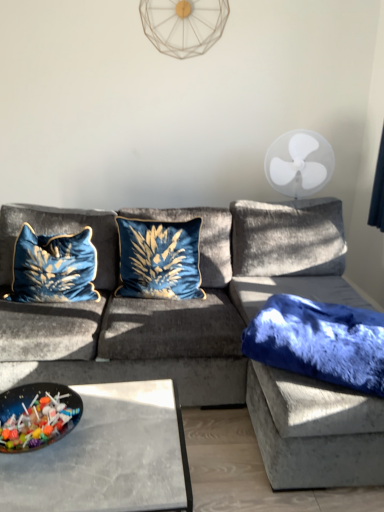
Question: Is white plastic fan at upper right, which is the second mechanical fan from left to right, next to velvet blue couch at center and touching it?

Choices:
 (A) yes
 (B) no

Answer: (B)

Question: Does white plastic fan at upper right, acting as the first mechanical fan starting from the bottom, have a smaller size compared to velvet blue couch at center?

Choices:
 (A) no
 (B) yes

Answer: (B)

Question: From a real-world perspective, is white plastic fan at upper right, acting as the first mechanical fan starting from the bottom, on velvet blue couch at center?

Choices:
 (A) yes
 (B) no

Answer: (A)

Question: From the image's perspective, does white plastic fan at upper right, the 2th mechanical fan from the top, appear higher than velvet blue couch at center?

Choices:
 (A) yes
 (B) no

Answer: (A)

Question: Considering the relative positions of white plastic fan at upper right, acting as the first mechanical fan starting from the bottom, and velvet blue couch at center in the image provided, is white plastic fan at upper right, acting as the first mechanical fan starting from the bottom, behind velvet blue couch at center?

Choices:
 (A) no
 (B) yes

Answer: (B)

Question: From the image's perspective, is velvet blue pillow at left, the third pillow viewed from the right, located above or below glossy plastic bowl of candy at lower left?

Choices:
 (A) below
 (B) above

Answer: (B)

Question: From a real-world perspective, relative to glossy plastic bowl of candy at lower left, is velvet blue pillow at left, the third pillow viewed from the right, vertically above or below?

Choices:
 (A) below
 (B) above

Answer: (B)

Question: In the image, is velvet blue pillow at left, the third pillow viewed from the right, positioned in front of or behind glossy plastic bowl of candy at lower left?

Choices:
 (A) behind
 (B) front

Answer: (A)

Question: Does point (69, 234) appear closer or farther from the camera than point (34, 414)?

Choices:
 (A) farther
 (B) closer

Answer: (A)

Question: From the image's perspective, is velvet blue pillow at left, the third pillow viewed from the right, positioned above or below velvet blue pillow at center, positioned as the second pillow in right-to-left order?

Choices:
 (A) below
 (B) above

Answer: (A)

Question: Is velvet blue pillow at left, which ranks as the first pillow in left-to-right order, spatially inside velvet blue pillow at center, positioned as the second pillow in right-to-left order, or outside of it?

Choices:
 (A) inside
 (B) outside

Answer: (B)

Question: In the image, is velvet blue pillow at left, which ranks as the first pillow in left-to-right order, positioned in front of or behind velvet blue pillow at center, the second pillow when ordered from left to right?

Choices:
 (A) behind
 (B) front

Answer: (B)

Question: Considering the relative positions of velvet blue pillow at left, which ranks as the first pillow in left-to-right order, and velvet blue pillow at center, the second pillow when ordered from left to right, in the image provided, is velvet blue pillow at left, which ranks as the first pillow in left-to-right order, to the left or to the right of velvet blue pillow at center, the second pillow when ordered from left to right,?

Choices:
 (A) left
 (B) right

Answer: (A)

Question: Considering their positions, is velvet blue couch at center located in front of or behind fuzzy blue blanket at right, marked as the 3th pillow in a left-to-right arrangement?

Choices:
 (A) behind
 (B) front

Answer: (B)

Question: Looking at the image, does velvet blue couch at center seem bigger or smaller compared to fuzzy blue blanket at right, marked as the 3th pillow in a left-to-right arrangement?

Choices:
 (A) small
 (B) big

Answer: (B)